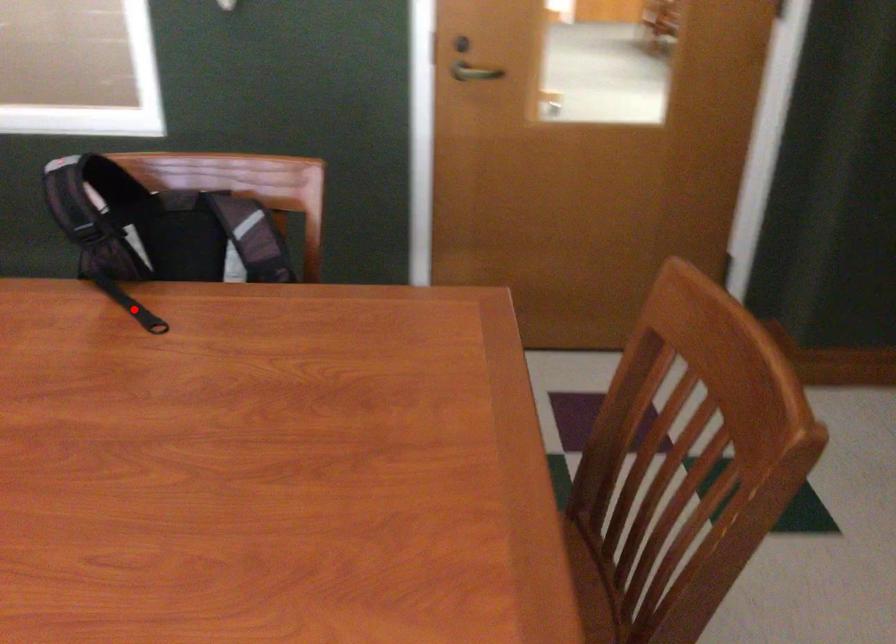
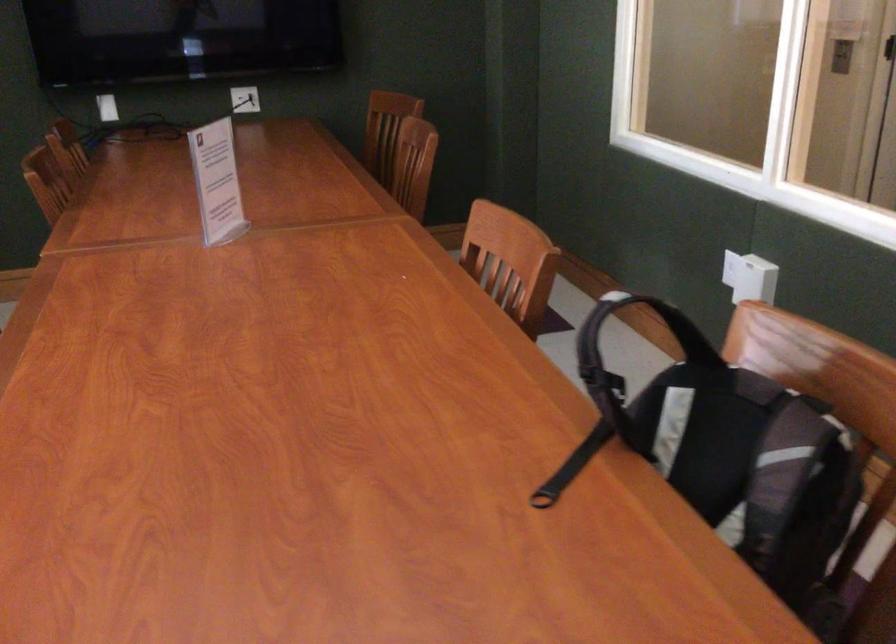
In the second image, find the point that corresponds to the highlighted location in the first image.

(572, 466)